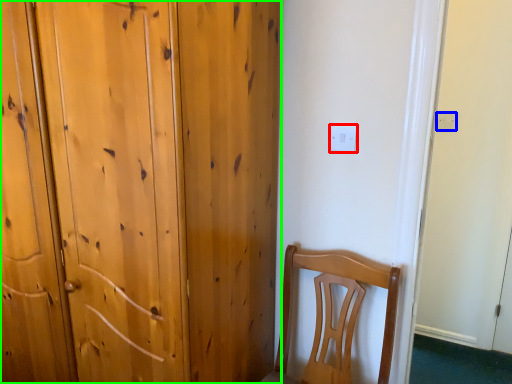
Question: Based on their relative distances, which object is farther from electric outlet (highlighted by a red box)? Choose from electric outlet (highlighted by a blue box) and door (highlighted by a green box).

Choices:
 (A) electric outlet
 (B) door

Answer: (A)